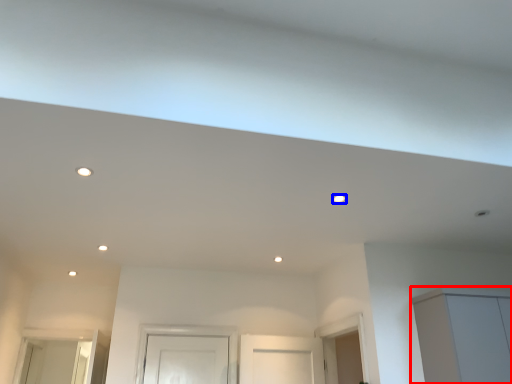
Question: Which point is further to the camera, cabinetry (highlighted by a red box) or lighting (highlighted by a blue box)?

Choices:
 (A) cabinetry
 (B) lighting

Answer: (A)